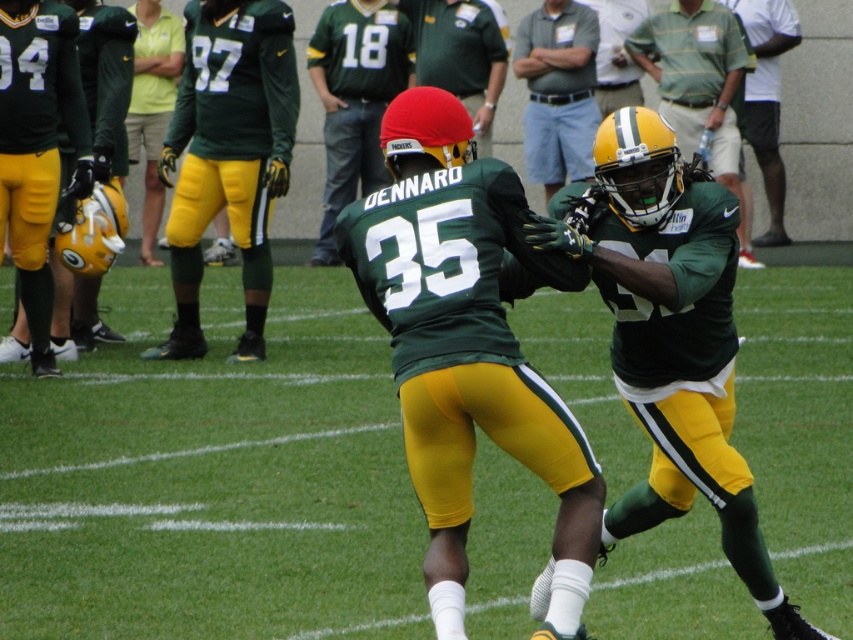
You are a photographer standing at the edge of the football field. You need to take a photo that includes both the matte green helmet at upper right and the light blue cotton shirt at center. Based on their positions, which object should you adjust your camera to focus on first to ensure both are in the frame?

The matte green helmet at upper right is to the right of the light blue cotton shirt at center. To include both in the frame, focus on the light blue cotton shirt at center first, then adjust the camera to include the matte green helmet at upper right which is positioned further to the right.